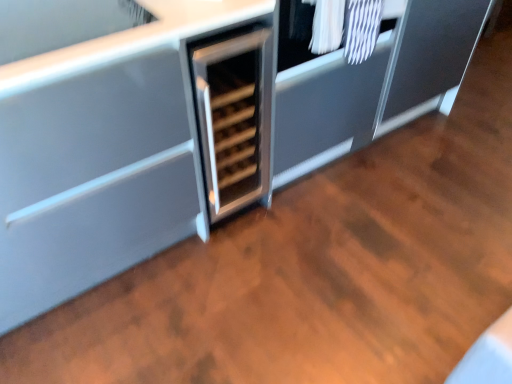
Question: Is white textured laundry at upper right with satin silver wine cooler at center?

Choices:
 (A) no
 (B) yes

Answer: (A)

Question: Considering the relative positions of white textured laundry at upper right and satin silver wine cooler at center in the image provided, is white textured laundry at upper right to the right of satin silver wine cooler at center from the viewer's perspective?

Choices:
 (A) no
 (B) yes

Answer: (B)

Question: Considering the relative positions of white textured laundry at upper right and satin silver wine cooler at center in the image provided, is white textured laundry at upper right in front of satin silver wine cooler at center?

Choices:
 (A) yes
 (B) no

Answer: (A)

Question: Can you confirm if white textured laundry at upper right is shorter than satin silver wine cooler at center?

Choices:
 (A) yes
 (B) no

Answer: (A)

Question: Is white textured laundry at upper right positioned beyond the bounds of satin silver wine cooler at center?

Choices:
 (A) yes
 (B) no

Answer: (A)

Question: From a real-world perspective, is white textured laundry at upper right under satin silver wine cooler at center?

Choices:
 (A) yes
 (B) no

Answer: (B)

Question: Is satin silver wine cooler at center far from white textured laundry at upper right?

Choices:
 (A) no
 (B) yes

Answer: (A)

Question: From the image's perspective, is satin silver wine cooler at center located beneath white textured laundry at upper right?

Choices:
 (A) yes
 (B) no

Answer: (A)

Question: Can you confirm if satin silver wine cooler at center is bigger than white textured laundry at upper right?

Choices:
 (A) no
 (B) yes

Answer: (B)

Question: Is satin silver wine cooler at center further to camera compared to white textured laundry at upper right?

Choices:
 (A) no
 (B) yes

Answer: (B)

Question: From a real-world perspective, does satin silver wine cooler at center sit lower than white textured laundry at upper right?

Choices:
 (A) no
 (B) yes

Answer: (B)

Question: Would you say satin silver wine cooler at center contains white textured laundry at upper right?

Choices:
 (A) no
 (B) yes

Answer: (A)

Question: Considering the positions of satin silver wine cooler at center and white textured laundry at upper right in the image, is satin silver wine cooler at center bigger or smaller than white textured laundry at upper right?

Choices:
 (A) small
 (B) big

Answer: (B)